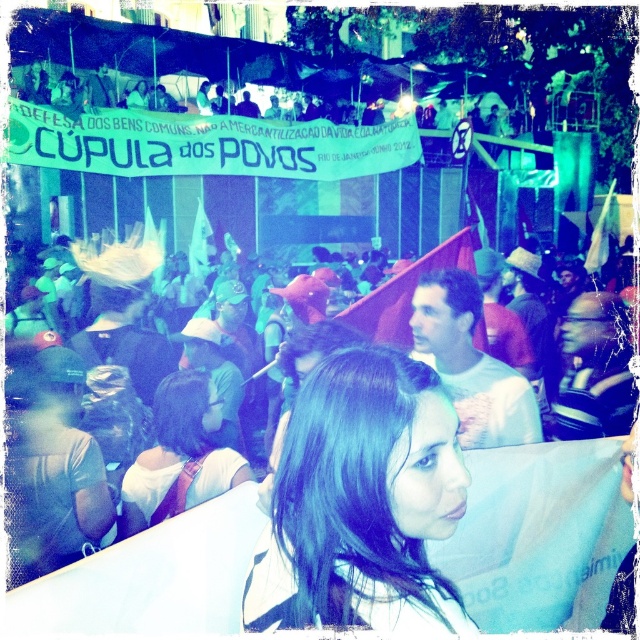
Question: Which object appears closest to the camera in this image?

Choices:
 (A) matte black glasses at center
 (B) matte black shirt at center
 (C) red fabric flag at center

Answer: (B)

Question: Based on their relative distances, which object is nearer to the matte brown hair at center?

Choices:
 (A) dark brown hair at center
 (B) red fabric flag at center

Answer: (A)

Question: Is dark brown hair at center positioned at the back of white matte shirt at center?

Choices:
 (A) yes
 (B) no

Answer: (B)

Question: Is matte black glasses at center to the right of red fabric flag at center from the viewer's perspective?

Choices:
 (A) yes
 (B) no

Answer: (A)

Question: Which object is closer to the camera taking this photo?

Choices:
 (A) matte black shirt at center
 (B) dark brown hair at center
 (C) matte brown hair at center
 (D) white matte shirt at center

Answer: (B)

Question: Can you confirm if dark brown hair at center is bigger than red fabric flag at center?

Choices:
 (A) yes
 (B) no

Answer: (B)